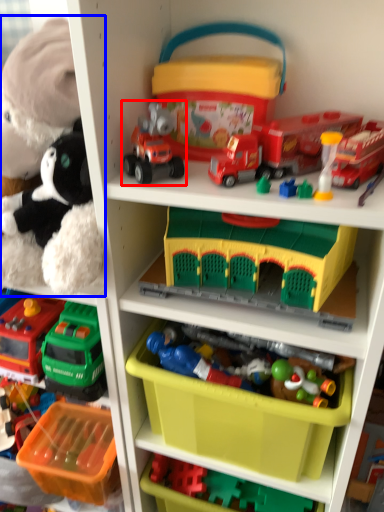
Question: Which of the following is the farthest to the observer, toy (highlighted by a red box) or toy (highlighted by a blue box)?

Choices:
 (A) toy
 (B) toy

Answer: (A)